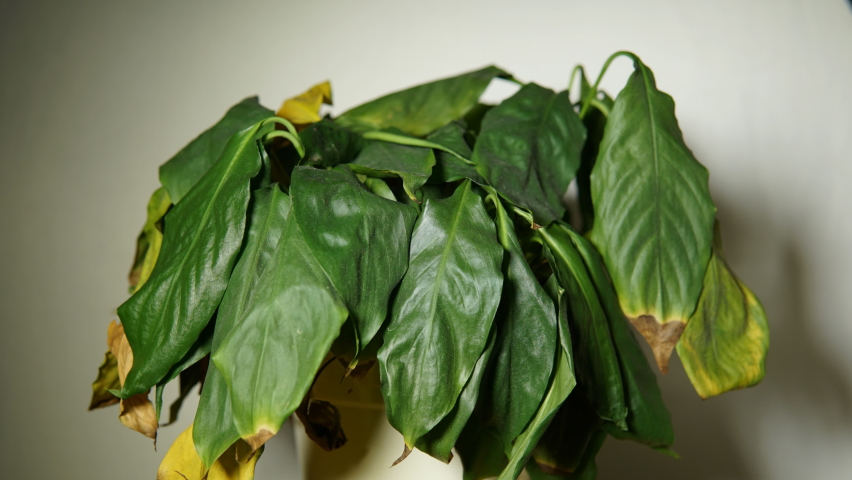
The width and height of the screenshot is (852, 480). In order to click on unhealthy plant in this screenshot , I will do `click(417, 221)`.